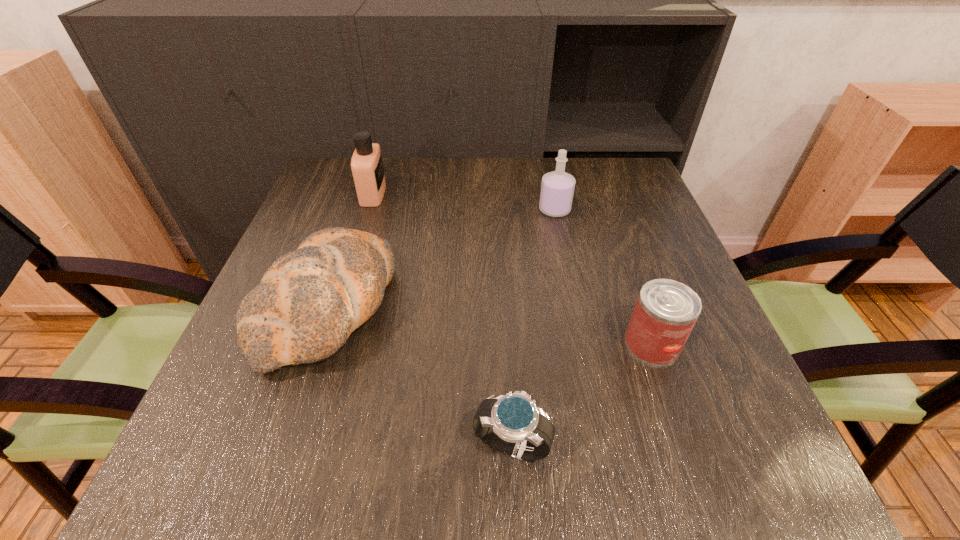
At what (x,y) coordinates should I click in order to perform the action: click on the left perfume. Please return your answer as a coordinate pair (x, y). Looking at the image, I should click on (367, 168).

Find the location of a particular element. Image resolution: width=960 pixels, height=540 pixels. the fourth object from left to right is located at coordinates (557, 188).

You are a GUI agent. You are given a task and a screenshot of the screen. Output one action in this format:
    pyautogui.click(x=<x>, y=<y>)
    Task: Click on the bread
    The width and height of the screenshot is (960, 540).
    Given the screenshot: What is the action you would take?
    pyautogui.click(x=309, y=301)

Locate an element on the screen. can is located at coordinates pos(666,311).

You are a GUI agent. You are given a task and a screenshot of the screen. Output one action in this format:
    pyautogui.click(x=<x>, y=<y>)
    Task: Click on the nearest object
    
    Given the screenshot: What is the action you would take?
    pyautogui.click(x=512, y=424)

You are a GUI agent. You are given a task and a screenshot of the screen. Output one action in this format:
    pyautogui.click(x=<x>, y=<y>)
    Task: Click on the shortest object
    The height and width of the screenshot is (540, 960).
    Given the screenshot: What is the action you would take?
    pyautogui.click(x=512, y=424)

Locate an element on the screen. vacant space located 0.200m on the front label of the left perfume is located at coordinates (461, 194).

The image size is (960, 540). Identify the location of free region located on the back of the right perfume. (547, 174).

The width and height of the screenshot is (960, 540). I want to click on vacant space situated on the right of the bread, so click(x=517, y=305).

Locate an element on the screen. free space located 0.120m on the back of the can is located at coordinates (630, 280).